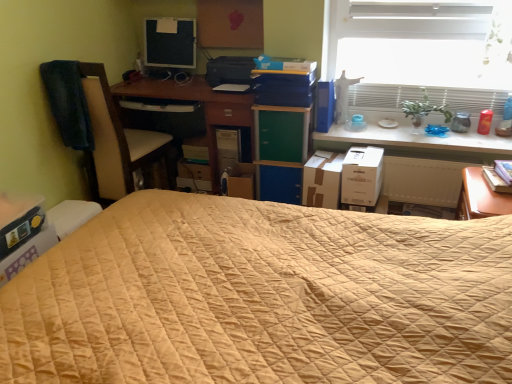
Locate an element on the screen. This screenshot has width=512, height=384. blank space to the left of green glossy plant at upper right is located at coordinates (380, 132).